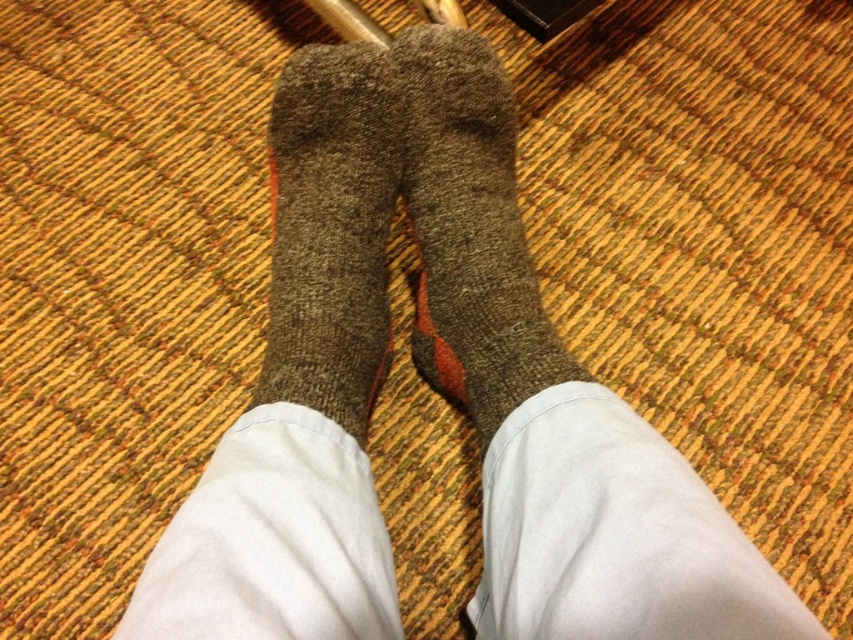
You are standing in a room with a striped carpet. There is a point at coordinates (469, 230) in the image. What object is located at that point?

The gray woolen sock at center is represented by point (469, 230).

You are a fashion stylist trying to match socks for a client. You have two socks in front of you, a gray woolen sock at center and a brown woolen sock at center. Which sock is taller?

The gray woolen sock at center is much taller than the brown woolen sock at center, so the gray woolen sock at center is the taller one.

You are a photographer setting up a shoot and need to adjust the lighting to highlight both the gray woolen sock at center and the brown woolen sock at center. Since the socks are positioned close to each other, you want to ensure that each sock is evenly lit. Based on their positions, which sock should you adjust the light towards to achieve balanced illumination?

The gray woolen sock at center is positioned on the right side of brown woolen sock at center. To achieve balanced illumination, adjust the light towards the gray woolen sock at center since it is on the right, ensuring both socks receive equal light distribution.